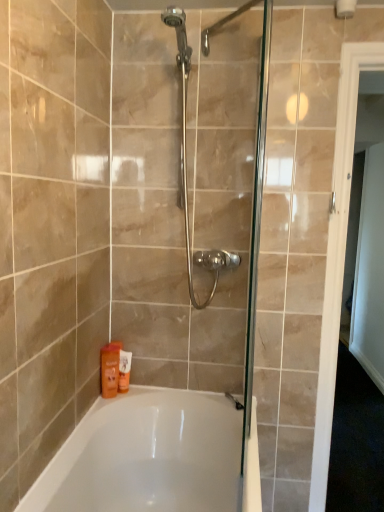
This screenshot has width=384, height=512. Describe the element at coordinates (124, 371) in the screenshot. I see `orange matte lotion at lower left, arranged as the 2th toiletry when viewed from the front` at that location.

Describe the element at coordinates (337, 255) in the screenshot. The width and height of the screenshot is (384, 512). I see `white glossy door at right` at that location.

The width and height of the screenshot is (384, 512). What are the coordinates of `orange matte lotion at lower left, arranged as the 2th toiletry when viewed from the front` in the screenshot? It's located at (124, 371).

Is orange matte lotion at lower left, the first toiletry viewed from the back, wider or thinner than white glossy bathtub at lower center?

orange matte lotion at lower left, the first toiletry viewed from the back, is thinner than white glossy bathtub at lower center.

Does point (126, 355) come behind point (152, 510)?

Yes.

Where is `bathtub on the right of orange matte lotion at lower left, the first toiletry viewed from the back`? bathtub on the right of orange matte lotion at lower left, the first toiletry viewed from the back is located at coordinates (153, 457).

Is orange matte lotion at lower left, arranged as the 2th toiletry when viewed from the front, in contact with white glossy bathtub at lower center?

They are not placed beside each other.

From the image's perspective, between orange matte lotion at lower left, arranged as the 2th toiletry when viewed from the front, and orange matte bottle at lower left, which ranks as the second toiletry in back-to-front order, which one is located above?

orange matte bottle at lower left, which ranks as the second toiletry in back-to-front order.

Considering the positions of objects orange matte lotion at lower left, the first toiletry viewed from the back, and orange matte bottle at lower left, which is counted as the first toiletry, starting from the front, in the image provided, who is more to the left, orange matte lotion at lower left, the first toiletry viewed from the back, or orange matte bottle at lower left, which is counted as the first toiletry, starting from the front,?

From the viewer's perspective, orange matte bottle at lower left, which is counted as the first toiletry, starting from the front, appears more on the left side.

Can you tell me how much orange matte lotion at lower left, the first toiletry viewed from the back, and orange matte bottle at lower left, which is counted as the first toiletry, starting from the front, differ in facing direction?

The facing directions of orange matte lotion at lower left, the first toiletry viewed from the back, and orange matte bottle at lower left, which is counted as the first toiletry, starting from the front, are 0.00222 degrees apart.

Does orange matte lotion at lower left, arranged as the 2th toiletry when viewed from the front, have a lesser height compared to orange matte bottle at lower left, which ranks as the second toiletry in back-to-front order?

Yes.

From a real-world perspective, who is located lower, orange matte bottle at lower left, which is counted as the first toiletry, starting from the front, or white glossy bathtub at lower center?

From a 3D spatial view, white glossy bathtub at lower center is below.

Which of these two, orange matte bottle at lower left, which is counted as the first toiletry, starting from the front, or white glossy bathtub at lower center, is wider?

white glossy bathtub at lower center.

Which is behind, orange matte bottle at lower left, which is counted as the first toiletry, starting from the front, or white glossy bathtub at lower center?

orange matte bottle at lower left, which is counted as the first toiletry, starting from the front, is more distant.

What are the coordinates of `the 1st toiletry behind the white glossy bathtub at lower center, counting from the anchor's position` in the screenshot? It's located at (110, 369).

Does point (106, 388) lie behind point (125, 383)?

That is False.

Is orange matte bottle at lower left, which is counted as the first toiletry, starting from the front, surrounding orange matte lotion at lower left, arranged as the 2th toiletry when viewed from the front?

That's incorrect, orange matte lotion at lower left, arranged as the 2th toiletry when viewed from the front, is not inside orange matte bottle at lower left, which is counted as the first toiletry, starting from the front.

Is orange matte bottle at lower left, which ranks as the second toiletry in back-to-front order, thinner than orange matte lotion at lower left, arranged as the 2th toiletry when viewed from the front?

No, orange matte bottle at lower left, which ranks as the second toiletry in back-to-front order, is not thinner than orange matte lotion at lower left, arranged as the 2th toiletry when viewed from the front.

Consider the image. From a real-world perspective, is orange matte bottle at lower left, which is counted as the first toiletry, starting from the front, below orange matte lotion at lower left, arranged as the 2th toiletry when viewed from the front?

No.

From the image's perspective, which object appears higher, white glossy bathtub at lower center or orange matte bottle at lower left, which is counted as the first toiletry, starting from the front?

From the image's view, orange matte bottle at lower left, which is counted as the first toiletry, starting from the front, is above.

Between white glossy bathtub at lower center and orange matte bottle at lower left, which ranks as the second toiletry in back-to-front order, which one appears on the left side from the viewer's perspective?

From the viewer's perspective, orange matte bottle at lower left, which ranks as the second toiletry in back-to-front order, appears more on the left side.

Can you confirm if white glossy bathtub at lower center is taller than orange matte bottle at lower left, which is counted as the first toiletry, starting from the front?

Yes.

Is white glossy bathtub at lower center completely or partially outside of orange matte bottle at lower left, which ranks as the second toiletry in back-to-front order?

Yes, white glossy bathtub at lower center is located beyond the bounds of orange matte bottle at lower left, which ranks as the second toiletry in back-to-front order.

Can you tell me how much white glossy bathtub at lower center and white glossy door at right differ in facing direction?

The facing directions of white glossy bathtub at lower center and white glossy door at right are 90 degrees apart.

From a real-world perspective, is white glossy bathtub at lower center physically located above or below white glossy door at right?

In terms of real-world spatial position, white glossy bathtub at lower center is below white glossy door at right.

From the image's perspective, would you say white glossy bathtub at lower center is shown under white glossy door at right?

Yes, from the image's perspective, white glossy bathtub at lower center is beneath white glossy door at right.

Consider the image. Is white glossy door at right located within white glossy bathtub at lower center?

No, white glossy door at right is not surrounded by white glossy bathtub at lower center.

Can white glossy door at right be found inside orange matte bottle at lower left, which is counted as the first toiletry, starting from the front?

No, white glossy door at right is not inside orange matte bottle at lower left, which is counted as the first toiletry, starting from the front.

From the image's perspective, is orange matte bottle at lower left, which ranks as the second toiletry in back-to-front order, above or below white glossy door at right?

From the image's perspective, orange matte bottle at lower left, which ranks as the second toiletry in back-to-front order, appears below white glossy door at right.

Considering the relative positions of orange matte bottle at lower left, which is counted as the first toiletry, starting from the front, and white glossy door at right in the image provided, is orange matte bottle at lower left, which is counted as the first toiletry, starting from the front, to the right of white glossy door at right from the viewer's perspective?

Incorrect, orange matte bottle at lower left, which is counted as the first toiletry, starting from the front, is not on the right side of white glossy door at right.

How many degrees apart are the facing directions of orange matte bottle at lower left, which is counted as the first toiletry, starting from the front, and white glossy door at right?

The angular difference between orange matte bottle at lower left, which is counted as the first toiletry, starting from the front, and white glossy door at right is 0.00195 degrees.

From a real-world perspective, which toiletry is the 1st one above the white glossy bathtub at lower center? Please provide its 2D coordinates.

[(124, 371)]

I want to click on toiletry on the right of orange matte bottle at lower left, which is counted as the first toiletry, starting from the front, so click(x=124, y=371).

Considering their positions, is white glossy bathtub at lower center positioned closer to orange matte lotion at lower left, the first toiletry viewed from the back, than white glossy door at right?

Based on the image, white glossy bathtub at lower center appears to be nearer to orange matte lotion at lower left, the first toiletry viewed from the back.

Which object lies nearer to the anchor point white glossy door at right, orange matte lotion at lower left, the first toiletry viewed from the back, or white glossy bathtub at lower center?

Among the two, white glossy bathtub at lower center is located nearer to white glossy door at right.

Looking at the image, which one is located closer to orange matte bottle at lower left, which is counted as the first toiletry, starting from the front, white glossy door at right or white glossy bathtub at lower center?

white glossy bathtub at lower center.

Consider the image. Considering their positions, is orange matte lotion at lower left, the first toiletry viewed from the back, positioned further to orange matte bottle at lower left, which is counted as the first toiletry, starting from the front, than white glossy bathtub at lower center?

Among the two, white glossy bathtub at lower center is located further to orange matte bottle at lower left, which is counted as the first toiletry, starting from the front.

When comparing their distances from white glossy door at right, does orange matte bottle at lower left, which is counted as the first toiletry, starting from the front, or orange matte lotion at lower left, the first toiletry viewed from the back, seem closer?

orange matte bottle at lower left, which is counted as the first toiletry, starting from the front, is closer to white glossy door at right.

Looking at the image, which one is located closer to orange matte lotion at lower left, the first toiletry viewed from the back, white glossy door at right or white glossy bathtub at lower center?

white glossy bathtub at lower center.

From the image, which object appears to be nearer to orange matte bottle at lower left, which ranks as the second toiletry in back-to-front order, orange matte lotion at lower left, the first toiletry viewed from the back, or white glossy door at right?

Among the two, orange matte lotion at lower left, the first toiletry viewed from the back, is located nearer to orange matte bottle at lower left, which ranks as the second toiletry in back-to-front order.

Looking at the image, which one is located closer to white glossy bathtub at lower center, white glossy door at right or orange matte lotion at lower left, the first toiletry viewed from the back?

orange matte lotion at lower left, the first toiletry viewed from the back, is closer to white glossy bathtub at lower center.

I want to click on toiletry located between orange matte bottle at lower left, which ranks as the second toiletry in back-to-front order, and white glossy door at right in the left-right direction, so click(x=124, y=371).

Where is `bathtub situated between orange matte bottle at lower left, which is counted as the first toiletry, starting from the front, and white glossy door at right from left to right`? bathtub situated between orange matte bottle at lower left, which is counted as the first toiletry, starting from the front, and white glossy door at right from left to right is located at coordinates (153, 457).

Find the location of a particular element. The width and height of the screenshot is (384, 512). bathtub between orange matte lotion at lower left, arranged as the 2th toiletry when viewed from the front, and white glossy door at right is located at coordinates 153,457.

The image size is (384, 512). I want to click on toiletry positioned between white glossy bathtub at lower center and orange matte lotion at lower left, arranged as the 2th toiletry when viewed from the front, from near to far, so click(x=110, y=369).